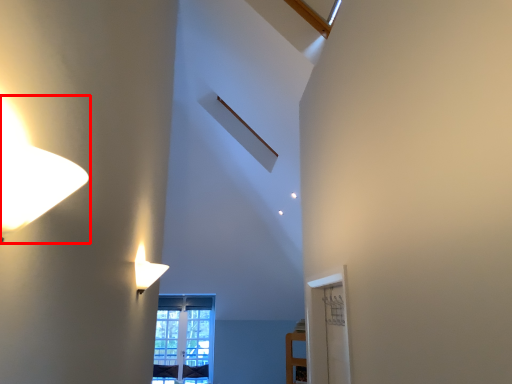
Question: From the image's perspective, what is the correct spatial relationship of lamp (annotated by the red box) in relation to window?

Choices:
 (A) above
 (B) below

Answer: (A)